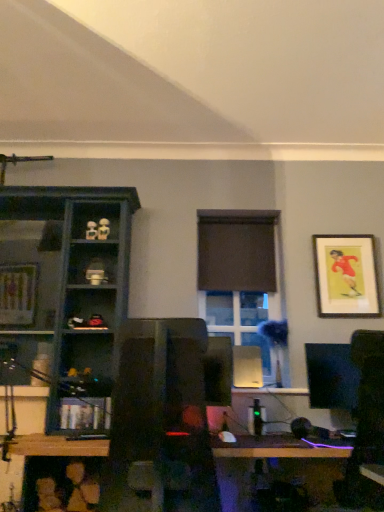
Describe the element at coordinates (103, 229) in the screenshot. I see `matte white figurine at upper left, the 1th toy when ordered from right to left` at that location.

Describe the element at coordinates (85, 414) in the screenshot. I see `wooden bookshelf at lower left, acting as the 1th shelf starting from the bottom` at that location.

What is the approximate height of matte gold picture frame at upper right?

It is 22.19 inches.

How much space does matte white figurine at upper left, arranged as the first toy when viewed from the left, occupy horizontally?

The width of matte white figurine at upper left, arranged as the first toy when viewed from the left, is 2.11 inches.

Describe the element at coordinates (236, 254) in the screenshot. I see `brown matte curtain at center` at that location.

Measure the distance between brown matte curtain at center and camera.

They are 2.89 meters apart.

You are a GUI agent. You are given a task and a screenshot of the screen. Output one action in this format:
    pyautogui.click(x=<x>, y=<y>)
    Task: Click on the clear glass window at center
    This screenshot has width=384, height=512.
    Given the screenshot: What is the action you would take?
    pyautogui.click(x=240, y=320)

Based on the photo, measure the distance between point (230, 311) and camera.

Point (230, 311) is 9.55 feet from camera.

Measure the distance between matte black monitor at right and camera.

2.44 meters.

Locate an element on the screen. matte white figurine at upper left, the 1th toy when ordered from right to left is located at coordinates (103, 229).

From a real-world perspective, which is physically below, matte white figurine at upper left, the 1th toy when ordered from right to left, or matte black monitor at right?

matte black monitor at right, from a real-world perspective.

Considering their positions, is matte white figurine at upper left, placed as the second toy when sorted from left to right, located in front of or behind matte black monitor at right?

matte white figurine at upper left, placed as the second toy when sorted from left to right, is positioned farther from the viewer than matte black monitor at right.

From the picture: Can you confirm if matte white figurine at upper left, placed as the second toy when sorted from left to right, is thinner than matte black monitor at right?

Correct, the width of matte white figurine at upper left, placed as the second toy when sorted from left to right, is less than that of matte black monitor at right.

Which is more to the left, matte white figurine at upper left, the 1th toy when ordered from right to left, or matte black monitor at right?

matte white figurine at upper left, the 1th toy when ordered from right to left.

From a real-world perspective, is matte black monitor at right below clear glass window at center?

Yes, from a real-world perspective, matte black monitor at right is below clear glass window at center.

Considering the sizes of objects matte black monitor at right and clear glass window at center in the image provided, who is shorter, matte black monitor at right or clear glass window at center?

With less height is matte black monitor at right.

Is matte black monitor at right thinner than clear glass window at center?

Incorrect, the width of matte black monitor at right is not less than that of clear glass window at center.

Which is further, [251,319] or [10,263]?

Point [251,319]

From the image's perspective, is clear glass window at center positioned above or below matte dark blue shelf at left, arranged as the first shelf when viewed from the top?

From the image's perspective, clear glass window at center appears below matte dark blue shelf at left, arranged as the first shelf when viewed from the top.

Is clear glass window at center positioned with its back to matte dark blue shelf at left, the 2th shelf ordered from the bottom?

clear glass window at center is not turned away from matte dark blue shelf at left, the 2th shelf ordered from the bottom.

Looking at the image, does matte gold picture frame at upper right seem bigger or smaller compared to clear glass window at center?

matte gold picture frame at upper right is smaller than clear glass window at center.

Is matte gold picture frame at upper right not inside clear glass window at center?

Yes, matte gold picture frame at upper right is located beyond the bounds of clear glass window at center.

In the image, is matte gold picture frame at upper right on the left side or the right side of clear glass window at center?

From the image, it's evident that matte gold picture frame at upper right is to the right of clear glass window at center.

The height and width of the screenshot is (512, 384). In order to click on window on the left of matte gold picture frame at upper right in this screenshot , I will do `click(240, 320)`.

Does point (267, 343) lie in front of point (97, 232)?

That is True.

Does clear glass window at center lie behind matte white figurine at upper left, the 1th toy when ordered from right to left?

Yes, clear glass window at center is behind matte white figurine at upper left, the 1th toy when ordered from right to left.

Can you confirm if clear glass window at center is positioned to the right of matte white figurine at upper left, placed as the second toy when sorted from left to right?

Indeed, clear glass window at center is positioned on the right side of matte white figurine at upper left, placed as the second toy when sorted from left to right.

From a real-world perspective, is clear glass window at center physically located above or below matte white figurine at upper left, the 1th toy when ordered from right to left?

clear glass window at center is situated lower than matte white figurine at upper left, the 1th toy when ordered from right to left, in the real world.

Between matte black monitor at right and brown matte curtain at center, which one has more height?

Standing taller between the two is brown matte curtain at center.

From the picture: Is matte black monitor at right positioned with its back to brown matte curtain at center?

No.

Between matte black monitor at right and brown matte curtain at center, which one has larger size?

matte black monitor at right.

Considering the sizes of objects wooden bookshelf at lower left, acting as the 1th shelf starting from the bottom, and clear glass window at center in the image provided, who is thinner, wooden bookshelf at lower left, acting as the 1th shelf starting from the bottom, or clear glass window at center?

clear glass window at center.

Looking at the image, does wooden bookshelf at lower left, acting as the 1th shelf starting from the bottom, seem bigger or smaller compared to clear glass window at center?

Considering their sizes, wooden bookshelf at lower left, acting as the 1th shelf starting from the bottom, takes up less space than clear glass window at center.

In terms of height, does wooden bookshelf at lower left, acting as the 1th shelf starting from the bottom, look taller or shorter compared to clear glass window at center?

In the image, wooden bookshelf at lower left, acting as the 1th shelf starting from the bottom, appears to be shorter than clear glass window at center.

Identify the location of computer monitor below the matte white figurine at upper left, placed as the second toy when sorted from left to right (from the image's perspective). (331, 377).

You are a GUI agent. You are given a task and a screenshot of the screen. Output one action in this format:
    pyautogui.click(x=<x>, y=<y>)
    Task: Click on the window above the matte black monitor at right (from a real-world perspective)
    Image resolution: width=384 pixels, height=512 pixels.
    Given the screenshot: What is the action you would take?
    pyautogui.click(x=240, y=320)

From the image, which object appears to be farther from matte dark blue shelf at left, arranged as the first shelf when viewed from the top, matte gold picture frame at upper right or clear glass window at center?

matte gold picture frame at upper right is further to matte dark blue shelf at left, arranged as the first shelf when viewed from the top.

Looking at the image, which one is located closer to matte white figurine at upper left, arranged as the first toy when viewed from the left, clear glass window at center or brown matte curtain at center?

brown matte curtain at center is positioned closer to the anchor matte white figurine at upper left, arranged as the first toy when viewed from the left.

Which object lies further to the anchor point wooden bookshelf at lower left, acting as the 1th shelf starting from the bottom, matte white figurine at upper left, acting as the 2th toy starting from the right, or matte black monitor at right?

matte black monitor at right.

From the image, which object appears to be farther from matte white figurine at upper left, placed as the second toy when sorted from left to right, brown matte curtain at center or matte black monitor at right?

matte black monitor at right is positioned further to the anchor matte white figurine at upper left, placed as the second toy when sorted from left to right.

Estimate the real-world distances between objects in this image. Which object is further from matte black monitor at right, matte white figurine at upper left, acting as the 2th toy starting from the right, or brown matte curtain at center?

matte white figurine at upper left, acting as the 2th toy starting from the right, is further to matte black monitor at right.

From the image, which object appears to be farther from wooden bookshelf at lower left, the second shelf from the top, matte white figurine at upper left, placed as the second toy when sorted from left to right, or clear glass window at center?

matte white figurine at upper left, placed as the second toy when sorted from left to right.

From the image, which object appears to be farther from matte white figurine at upper left, the 1th toy when ordered from right to left, wooden bookshelf at lower left, the second shelf from the top, or clear glass window at center?

Among the two, wooden bookshelf at lower left, the second shelf from the top, is located further to matte white figurine at upper left, the 1th toy when ordered from right to left.

Looking at the image, which one is located further to matte black monitor at right, matte white figurine at upper left, acting as the 2th toy starting from the right, or wooden bookshelf at lower left, acting as the 1th shelf starting from the bottom?

Among the two, matte white figurine at upper left, acting as the 2th toy starting from the right, is located further to matte black monitor at right.

Identify the location of toy between matte white figurine at upper left, acting as the 2th toy starting from the right, and clear glass window at center from left to right. (103, 229).

Find the location of a particular element. The image size is (384, 512). window located between matte dark blue shelf at left, the 2th shelf ordered from the bottom, and brown matte curtain at center in the left-right direction is located at coordinates (240, 320).

Identify the location of window between matte white figurine at upper left, the 1th toy when ordered from right to left, and matte black monitor at right from left to right. This screenshot has height=512, width=384. (240, 320).

Where is `shelf between matte white figurine at upper left, arranged as the first toy when viewed from the left, and matte gold picture frame at upper right`? shelf between matte white figurine at upper left, arranged as the first toy when viewed from the left, and matte gold picture frame at upper right is located at coordinates (85, 414).